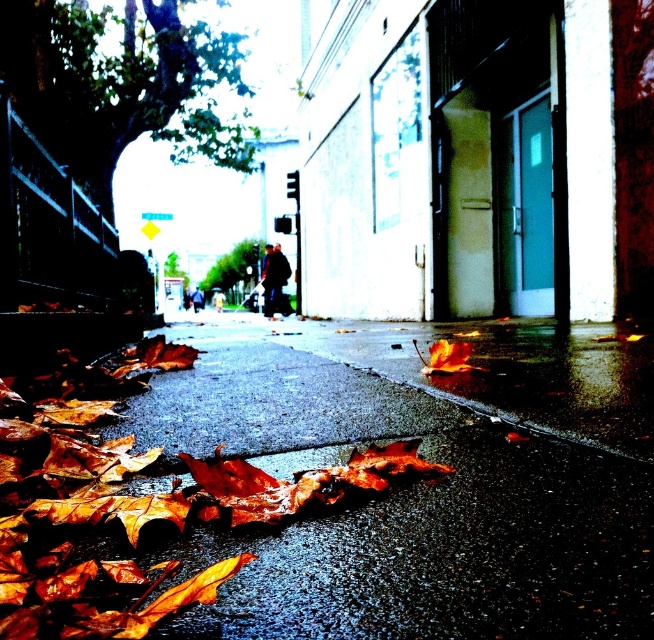
From the picture: Who is higher up, brown/dry leaves at center or green leafy tree at upper left?

Positioned higher is green leafy tree at upper left.

Is the position of brown/dry leaves at center less distant than that of green leafy tree at upper left?

Yes.

Between point (286, 636) and point (156, 49), which one is positioned behind?

The point (156, 49) is more distant.

The height and width of the screenshot is (640, 654). Find the location of `brown/dry leaves at center`. brown/dry leaves at center is located at coordinates (396, 499).

Is brown/dry leaves at center smaller than brown papery leaves at lower left?

No.

Between point (269, 624) and point (243, 464), which one is positioned behind?

The point (243, 464) is behind.

Is point (456, 627) in front of point (224, 502)?

Yes.

This screenshot has height=640, width=654. What are the coordinates of `brown/dry leaves at center` in the screenshot? It's located at (396, 499).

Between green leafy tree at upper left and green leafy tree at center, which one appears on the right side from the viewer's perspective?

From the viewer's perspective, green leafy tree at upper left appears more on the right side.

Who is higher up, green leafy tree at upper left or green leafy tree at center?

green leafy tree at upper left is above.

Between point (201, 74) and point (260, 244), which one is positioned in front?

Point (201, 74)

This screenshot has width=654, height=640. Find the location of `green leafy tree at upper left`. green leafy tree at upper left is located at coordinates (118, 84).